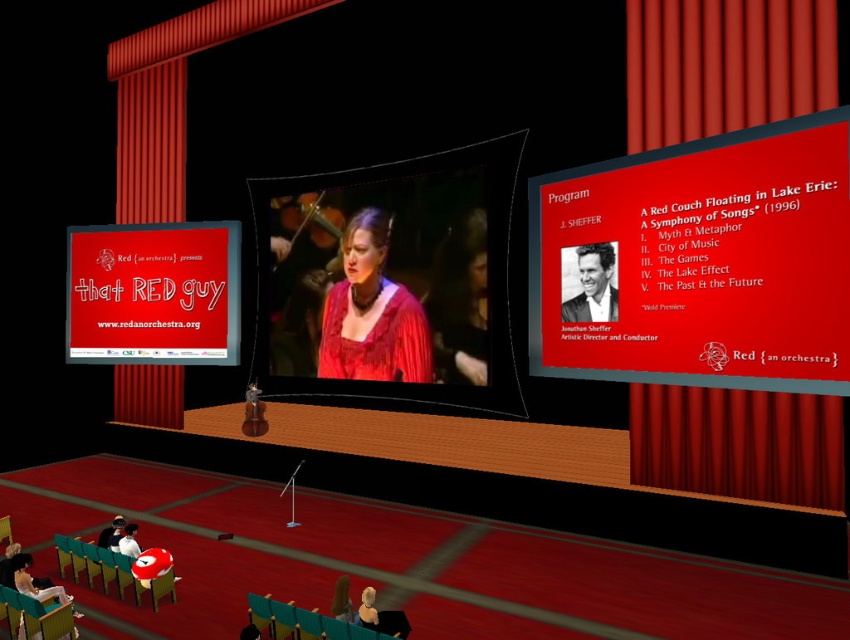
Between matte red program board at upper right and smooth beige head at center, which one is positioned higher?

matte red program board at upper right

Is matte red program board at upper right taller than smooth beige head at center?

Correct, matte red program board at upper right is much taller as smooth beige head at center.

Measure the distance between point (806, 346) and camera.

They are 4.73 meters apart.

This screenshot has width=850, height=640. I want to click on matte red program board at upper right, so click(x=700, y=262).

Is matte red sign at center to the left of smooth beige sweater at center from the viewer's perspective?

Correct, you'll find matte red sign at center to the left of smooth beige sweater at center.

Does point (97, 248) lie behind point (336, 605)?

That is True.

Is point (126, 358) farther from viewer compared to point (346, 614)?

Yes.

I want to click on matte red sign at center, so click(x=153, y=292).

Does matte red curtain at upper right come behind matte red sign at center?

That is False.

Can you confirm if matte red curtain at upper right is shorter than matte red sign at center?

Yes.

Find the location of `matte red curtain at upper right`. matte red curtain at upper right is located at coordinates (724, 65).